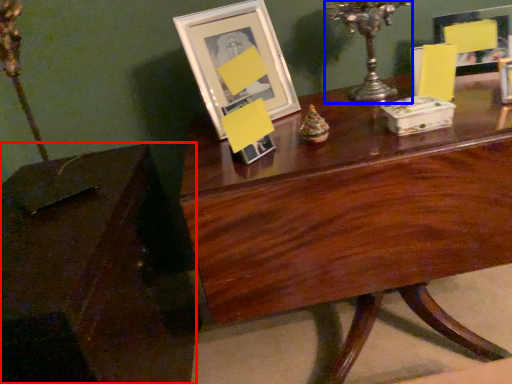
Question: Which object is further to the camera taking this photo, table (highlighted by a red box) or candle holder (highlighted by a blue box)?

Choices:
 (A) table
 (B) candle holder

Answer: (B)